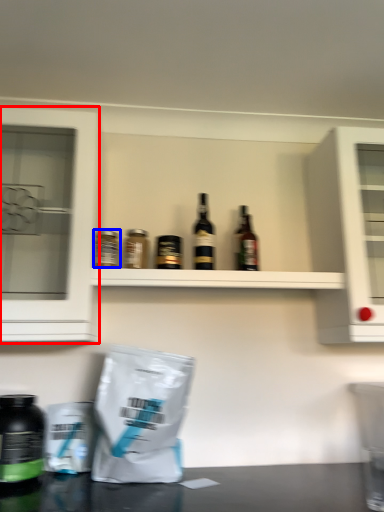
Question: Which of the following is the farthest to the observer, cabinetry (highlighted by a red box) or bottle (highlighted by a blue box)?

Choices:
 (A) cabinetry
 (B) bottle

Answer: (B)